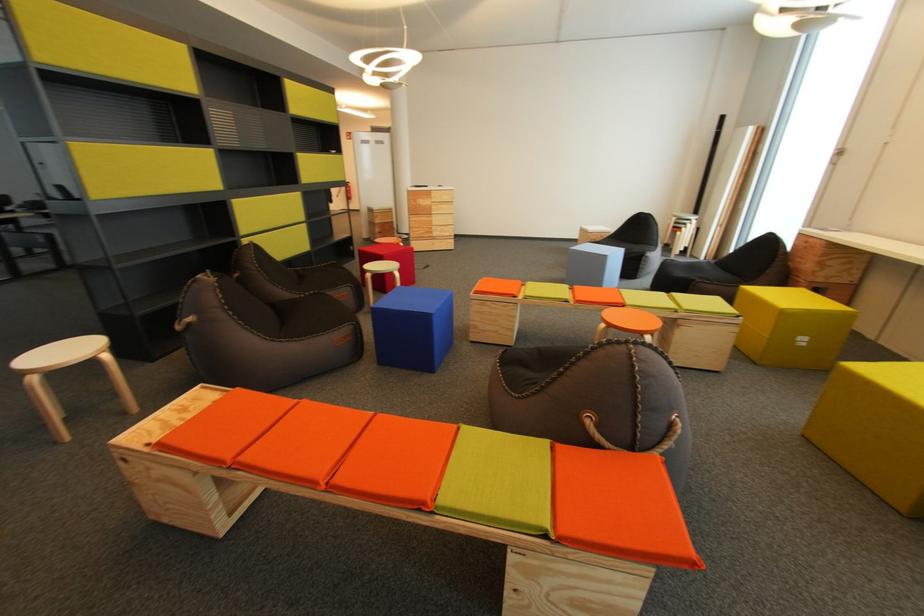
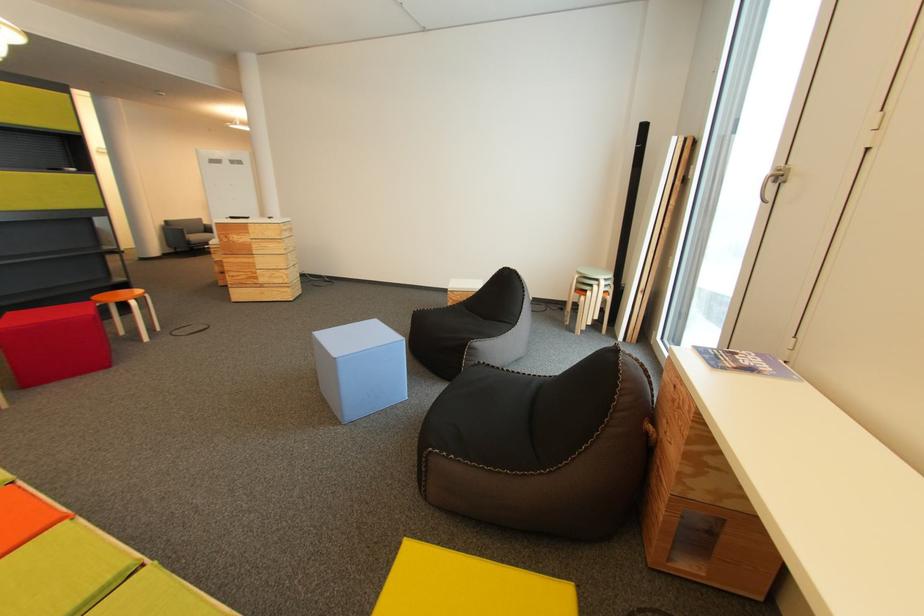
In a continuous first-person perspective shot, in which direction is the camera moving?

The cameraman walked toward right, forward.